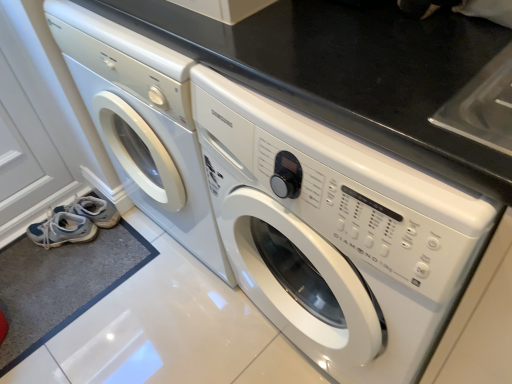
Identify the location of free location in front of light blue fabric shoe at lower left, which is the first shoe from bottom to top. Image resolution: width=512 pixels, height=384 pixels. [x=60, y=278].